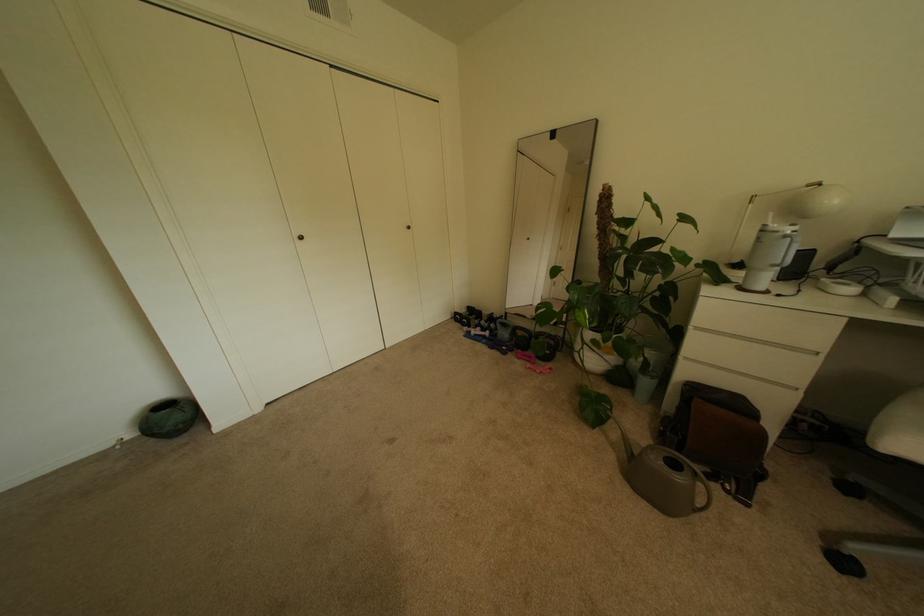
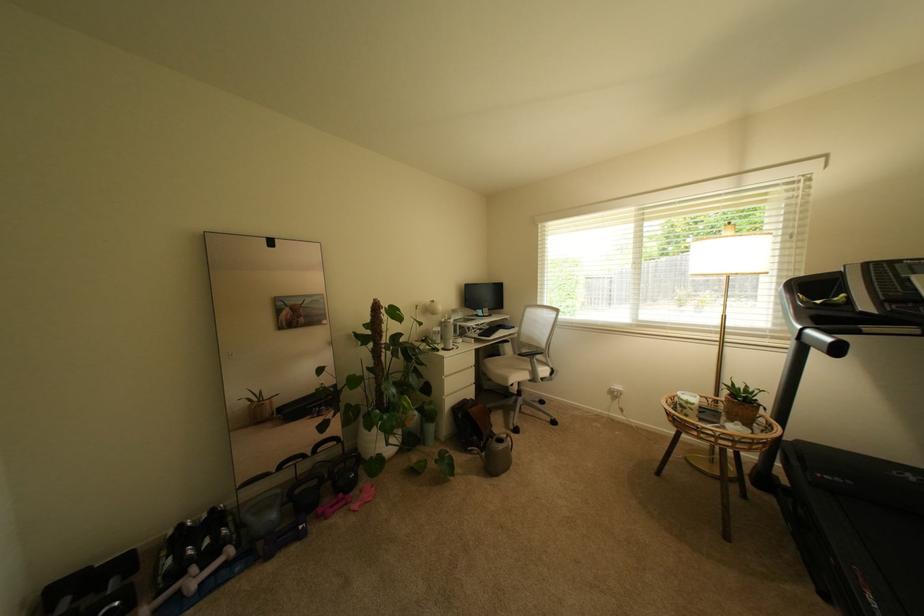
The point at (502, 315) is marked in the first image. Where is the corresponding point in the second image?

(188, 527)